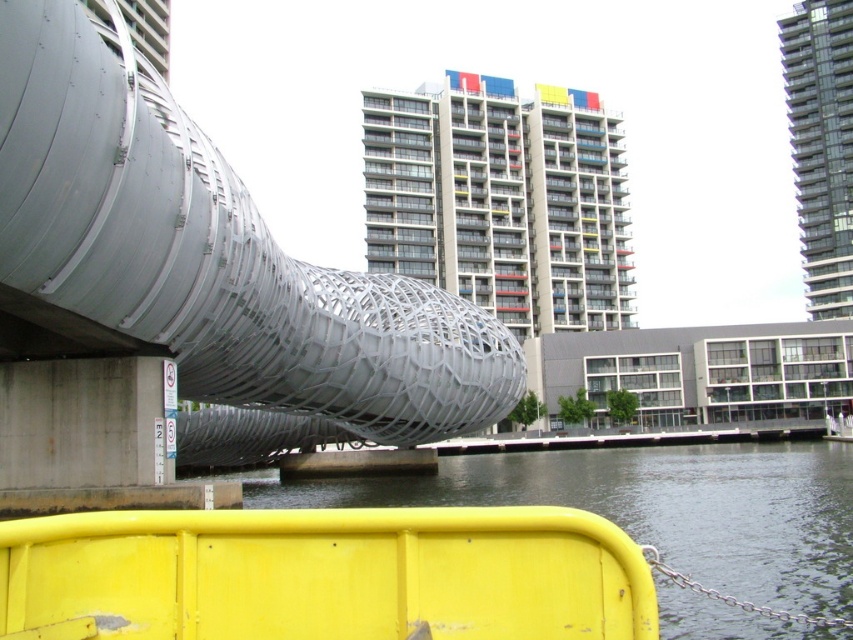
Does point (32, 131) come farther from viewer compared to point (830, 449)?

That is False.

Is metallic mesh bridge at center positioned in front of yellow plastic barrier at lower center?

That is False.

Does point (495, 378) lie behind point (740, 481)?

No, it is not.

Locate an element on the screen. metallic mesh bridge at center is located at coordinates point(187,276).

Can you confirm if metallic mesh bridge at center is positioned to the left of yellow matte rail at lower center?

Indeed, metallic mesh bridge at center is positioned on the left side of yellow matte rail at lower center.

Who is positioned more to the left, metallic mesh bridge at center or yellow matte rail at lower center?

metallic mesh bridge at center is more to the left.

Which is behind, point (329, 358) or point (389, 620)?

The point (329, 358) is more distant.

You are a GUI agent. You are given a task and a screenshot of the screen. Output one action in this format:
    pyautogui.click(x=<x>, y=<y>)
    Task: Click on the metallic mesh bridge at center
    
    Given the screenshot: What is the action you would take?
    pyautogui.click(x=187, y=276)

Which of these two, yellow matte rail at lower center or yellow plastic barrier at lower center, stands shorter?

yellow matte rail at lower center

Does yellow matte rail at lower center appear on the right side of yellow plastic barrier at lower center?

Incorrect, yellow matte rail at lower center is not on the right side of yellow plastic barrier at lower center.

Is point (123, 605) positioned before point (772, 586)?

Yes, it is in front of point (772, 586).

Where is `yellow matte rail at lower center`? yellow matte rail at lower center is located at coordinates 323,576.